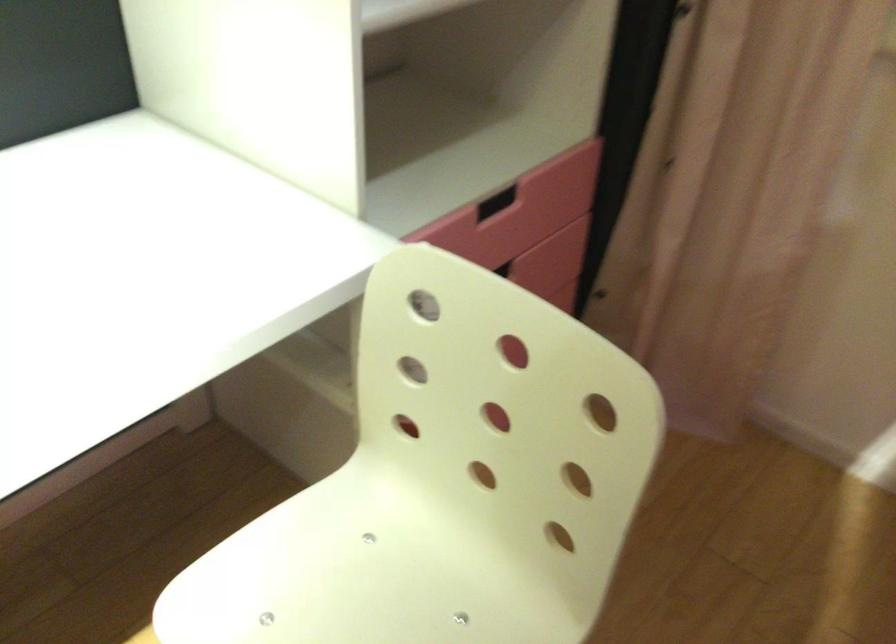
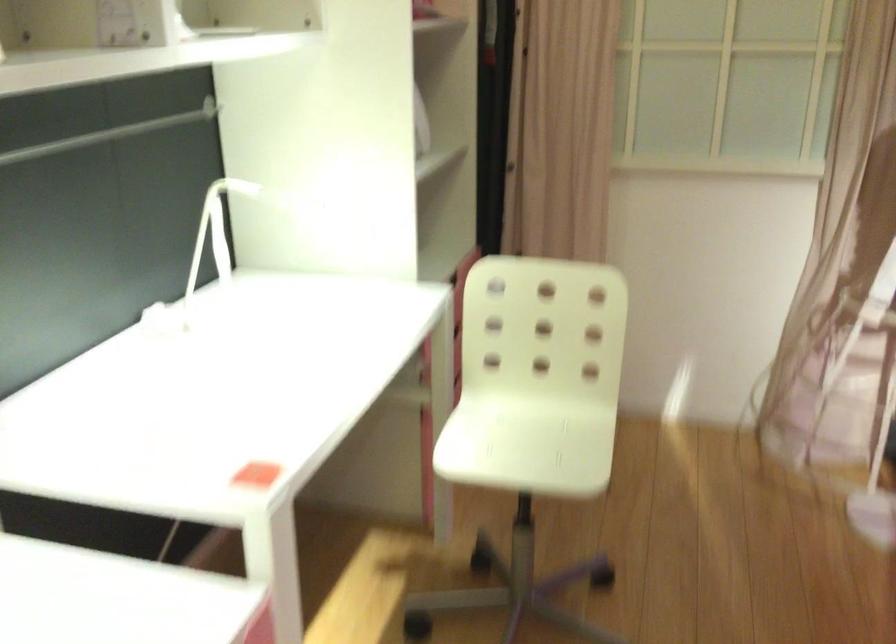
The point at [325,569] is marked in the first image. Where is the corresponding point in the second image?

(495, 431)